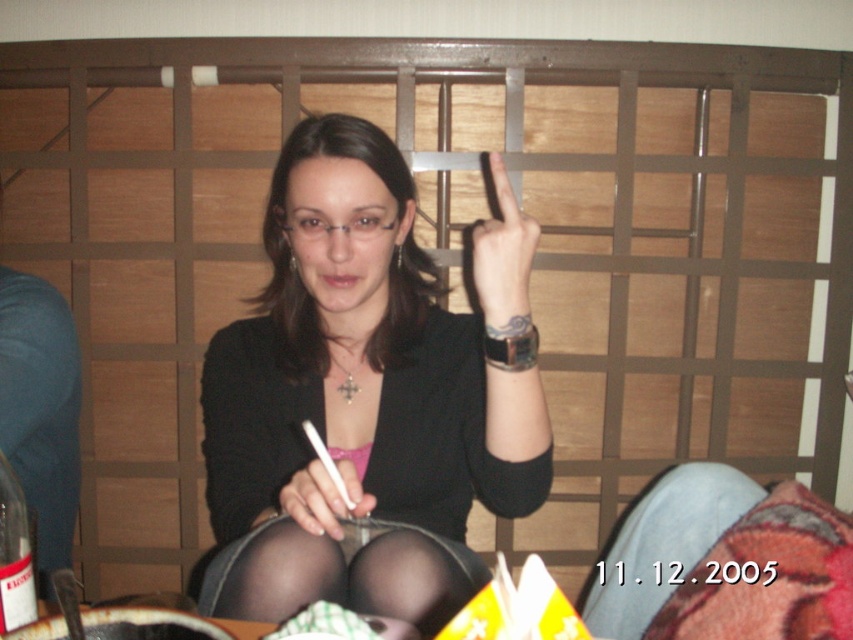
Does denim at lower right have a lesser width compared to smooth skin finger at upper center?

No.

Locate an element on the screen. denim at lower right is located at coordinates (662, 545).

Who is more distant from viewer, (497,182) or (361,490)?

Point (497,182)

Between point (492, 324) and point (329, 500), which one is positioned in front?

Point (329, 500) is more forward.

Locate an element on the screen. This screenshot has width=853, height=640. smooth skin finger at upper center is located at coordinates 502,252.

The width and height of the screenshot is (853, 640). I want to click on smooth skin finger at upper center, so click(x=502, y=252).

Is point (663, 499) positioned in front of point (325, 476)?

That is False.

Who is taller, denim at lower right or matte white pen at center?

denim at lower right is taller.

Does point (663, 500) lie in front of point (328, 500)?

No, it is not.

This screenshot has height=640, width=853. I want to click on denim at lower right, so click(662, 545).